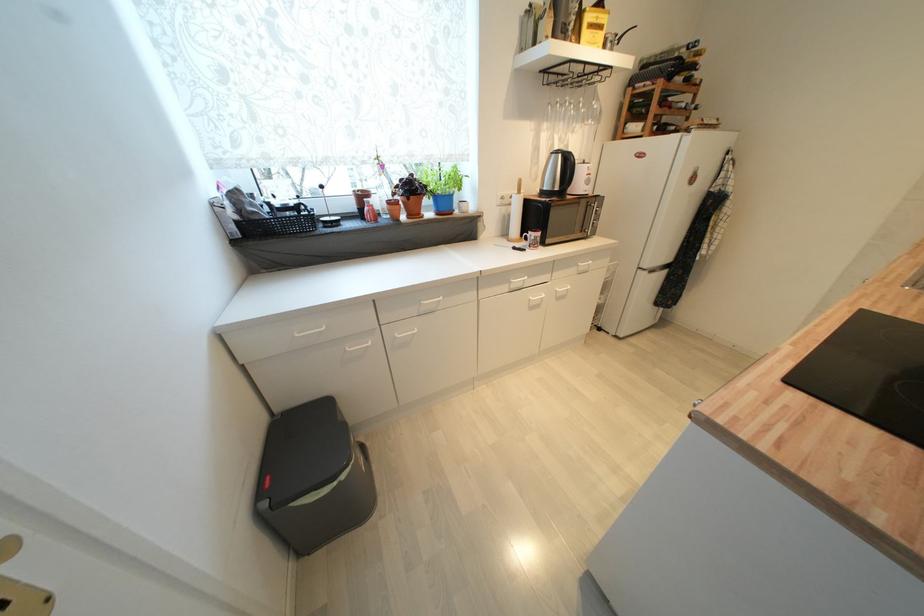
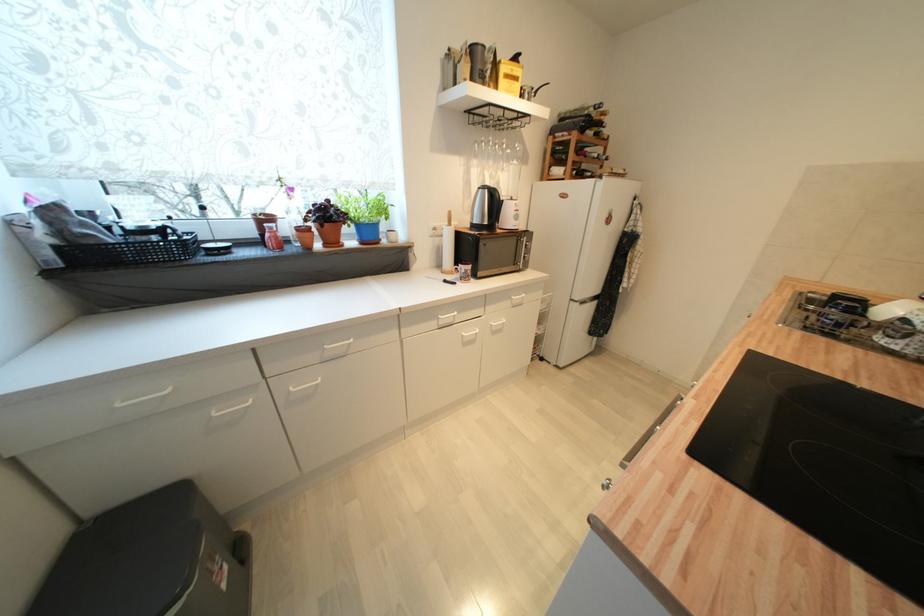
The point at [585,270] is marked in the first image. Where is the corresponding point in the second image?

(518, 304)